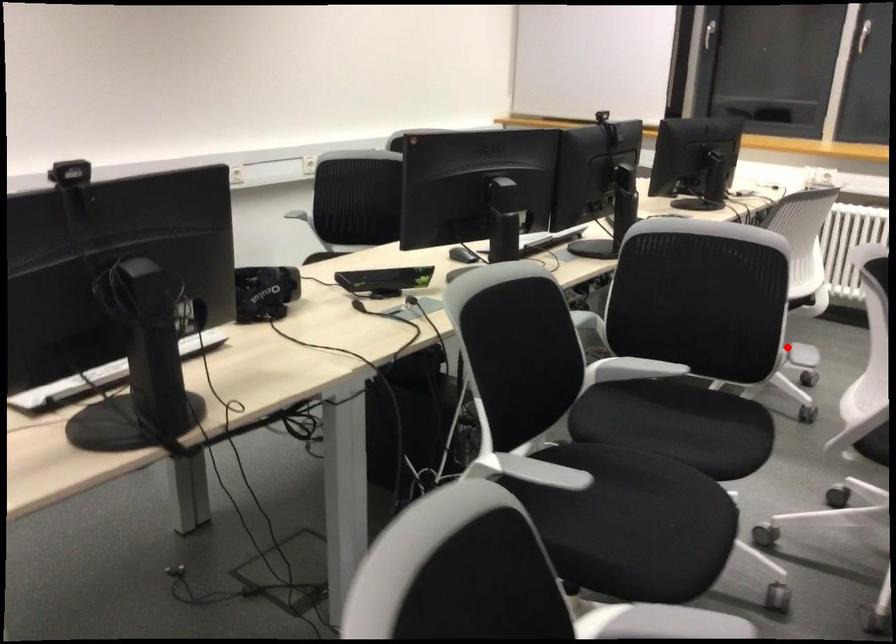
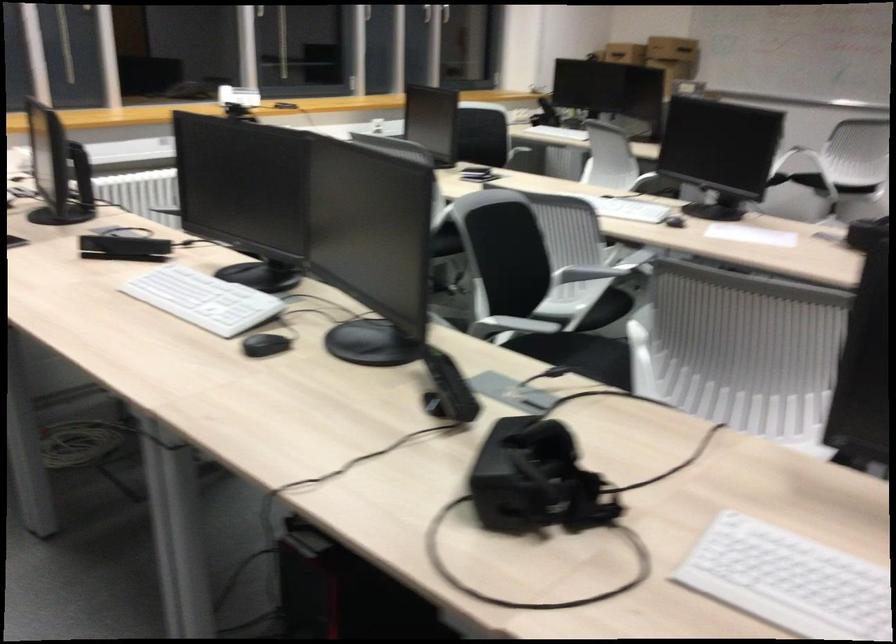
Question: A red point is marked in image1. In image2, is the corresponding 3D point closer to the camera or farther? Reply with the corresponding letter.

Choices:
 (A) The corresponding 3D point is closer.
 (B) The corresponding 3D point is farther.

Answer: (B)